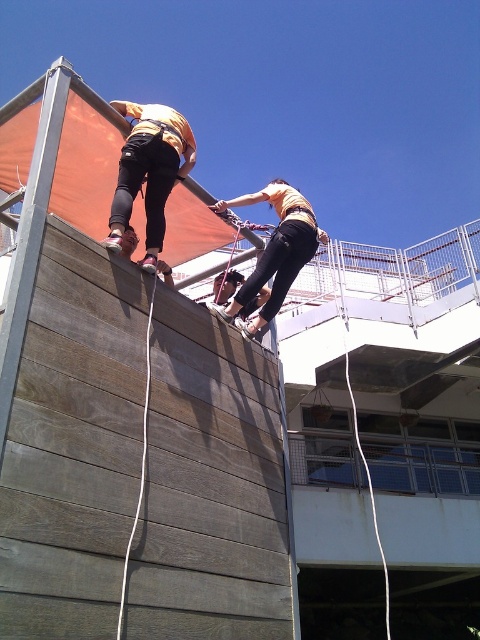
Between matte black pants at upper left and matte yellow shirt at center, which one appears on the right side from the viewer's perspective?

matte yellow shirt at center

Where is `matte black pants at upper left`? matte black pants at upper left is located at coordinates (149, 172).

Where is `matte black pants at upper left`? This screenshot has width=480, height=640. matte black pants at upper left is located at coordinates (149, 172).